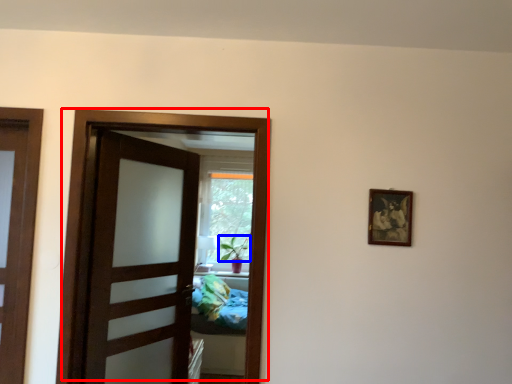
Question: Which object appears closest to the camera in this image, door (highlighted by a red box) or plant (highlighted by a blue box)?

Choices:
 (A) door
 (B) plant

Answer: (A)